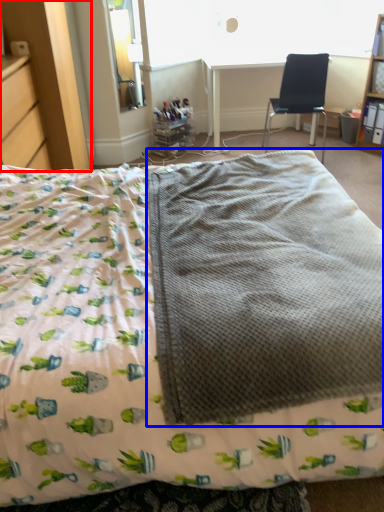
Question: Which object appears closest to the camera in this image, dresser (highlighted by a red box) or blanket (highlighted by a blue box)?

Choices:
 (A) dresser
 (B) blanket

Answer: (B)